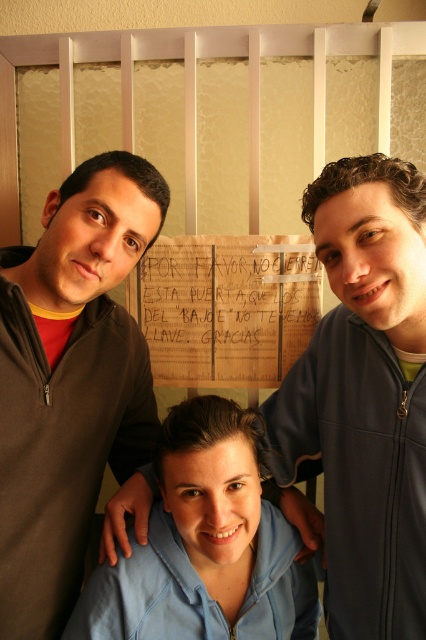
Does blue fleece jacket at center have a lesser height compared to wooden sign at center?

Incorrect, blue fleece jacket at center's height does not fall short of wooden sign at center's.

Between point (342, 529) and point (232, 380), which one is positioned in front?

Positioned in front is point (342, 529).

I want to click on blue fleece jacket at center, so click(x=362, y=397).

Can you confirm if dark brown zip-up sweater at left is shorter than wooden sign at center?

No.

Which is below, dark brown zip-up sweater at left or wooden sign at center?

dark brown zip-up sweater at left

Between point (106, 396) and point (247, 259), which one is positioned in front?

Positioned in front is point (106, 396).

Where is `dark brown zip-up sweater at left`? This screenshot has width=426, height=640. dark brown zip-up sweater at left is located at coordinates (71, 381).

Can you confirm if light blue zip-up hoodie at center is positioned above wooden sign at center?

Incorrect, light blue zip-up hoodie at center is not positioned above wooden sign at center.

Can you confirm if light blue zip-up hoodie at center is positioned below wooden sign at center?

Yes, light blue zip-up hoodie at center is below wooden sign at center.

Locate an element on the screen. light blue zip-up hoodie at center is located at coordinates (204, 547).